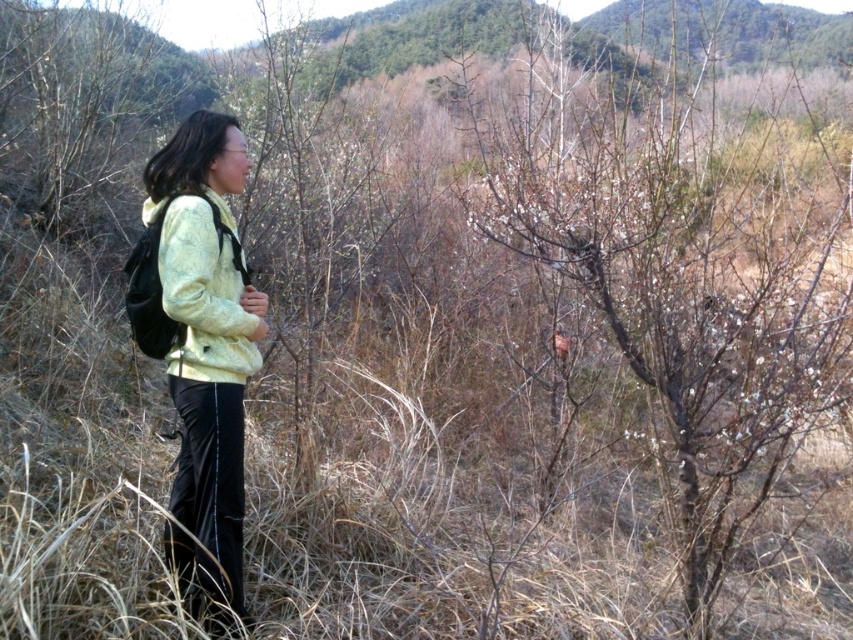
Question: Which point is farther to the camera?

Choices:
 (A) pos(224,141)
 (B) pos(183,372)
 (C) pos(757,173)

Answer: (C)

Question: Can you confirm if light yellow fleece at center is positioned below yellow textured jacket at left?

Choices:
 (A) yes
 (B) no

Answer: (A)

Question: Is bare branches at center to the right of yellow textured jacket at left from the viewer's perspective?

Choices:
 (A) no
 (B) yes

Answer: (B)

Question: Can you confirm if bare branches at center is positioned below yellow textured jacket at left?

Choices:
 (A) no
 (B) yes

Answer: (A)

Question: Which point is closer to the camera?

Choices:
 (A) light yellow fleece at center
 (B) yellow textured jacket at left

Answer: (B)

Question: Considering the real-world distances, which object is farthest from the yellow textured jacket at left?

Choices:
 (A) bare branches at center
 (B) light yellow fleece at center

Answer: (A)